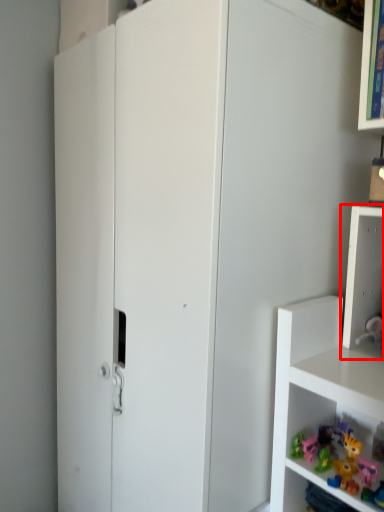
Question: From the image's perspective, what is the correct spatial relationship of shelf (annotated by the red box) in relation to toy?

Choices:
 (A) below
 (B) above

Answer: (B)